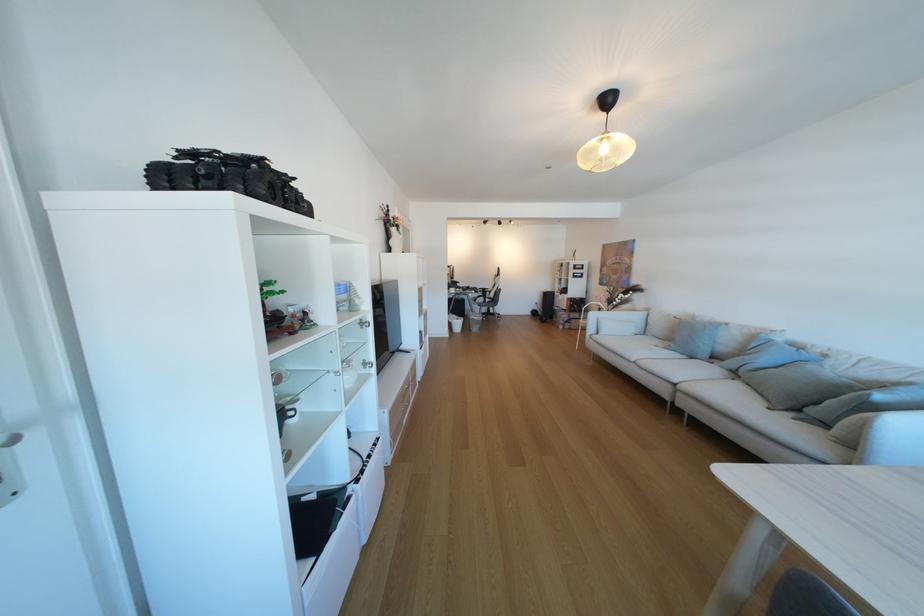
You are a GUI agent. You are given a task and a screenshot of the screen. Output one action in this format:
    pyautogui.click(x=<x>, y=<y>)
    Task: Click on the black chair sitting surface
    
    Given the screenshot: What is the action you would take?
    pyautogui.click(x=490, y=310)